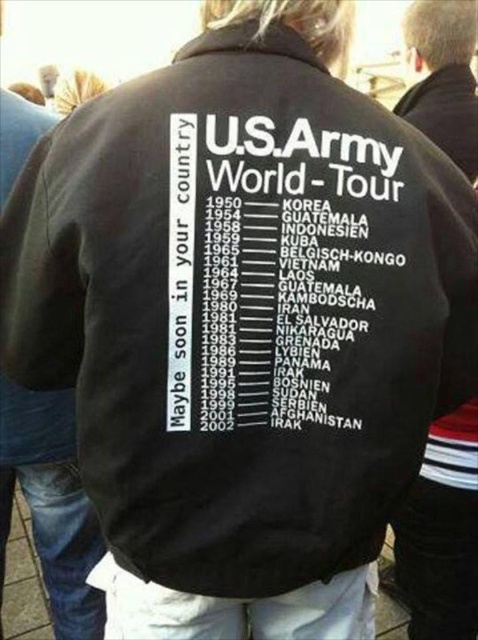
Does point (198, 380) lie in front of point (442, 93)?

Yes, point (198, 380) is in front of point (442, 93).

Can you confirm if black fabric text at center is thinner than black fabric jacket at upper center?

No.

Describe the element at coordinates (271, 269) in the screenshot. This screenshot has height=640, width=478. I see `black fabric text at center` at that location.

The image size is (478, 640). I want to click on black fabric text at center, so click(x=271, y=269).